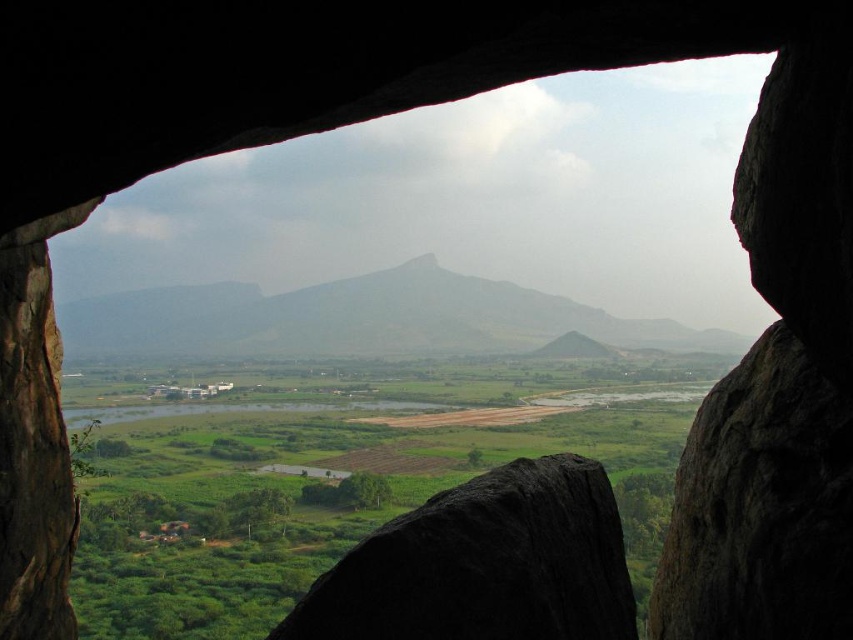
Question: Is black rough rock at center further to camera compared to gray rock formation at center?

Choices:
 (A) no
 (B) yes

Answer: (A)

Question: Which object is positioned farthest from the dark gray rough rock at right?

Choices:
 (A) gray rock formation at center
 (B) black rough rock at center

Answer: (A)

Question: Which object is closer to the camera taking this photo?

Choices:
 (A) black rough rock at center
 (B) dark gray rough rock at right

Answer: (B)

Question: Which of these objects is positioned closest to the dark gray rough rock at right?

Choices:
 (A) black rough rock at center
 (B) gray rock formation at center

Answer: (A)

Question: In this image, where is dark gray rough rock at right located relative to gray rock formation at center?

Choices:
 (A) left
 (B) right

Answer: (B)

Question: Can you confirm if black rough rock at center is positioned to the right of gray rock formation at center?

Choices:
 (A) no
 (B) yes

Answer: (B)